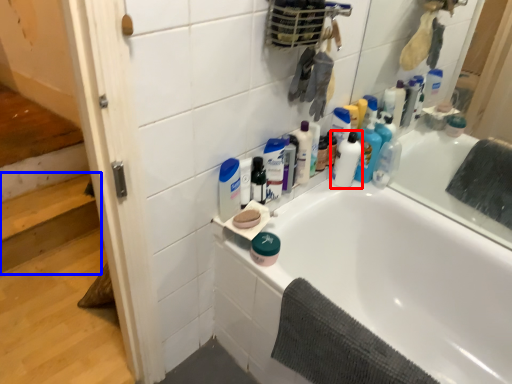
Question: Which point is closer to the camera, cleaning product (highlighted by a red box) or stairwell (highlighted by a blue box)?

Choices:
 (A) cleaning product
 (B) stairwell

Answer: (A)